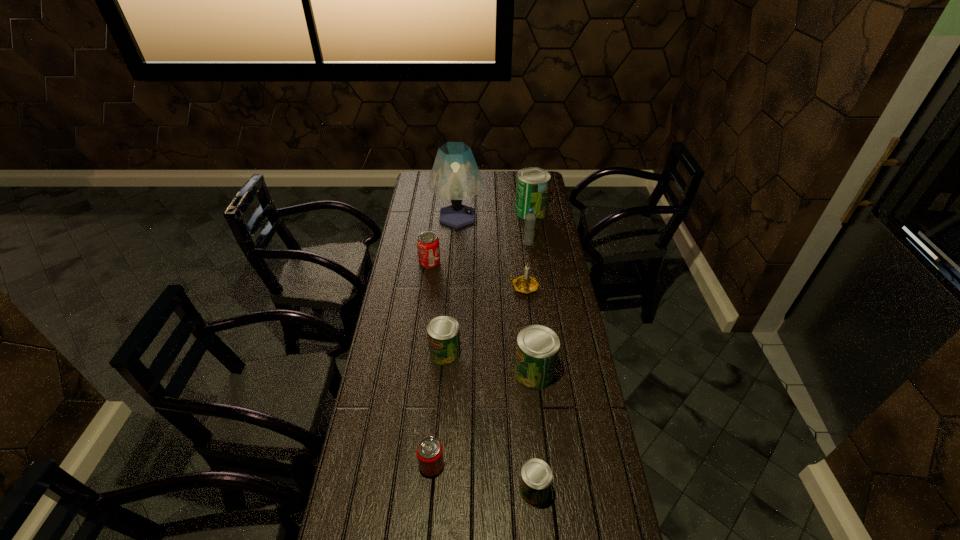
Where is `free spot located on the right of the candle holder`? Image resolution: width=960 pixels, height=540 pixels. free spot located on the right of the candle holder is located at coordinates (550, 287).

Find the location of a particular element. This screenshot has width=960, height=540. vacant position located on the right of the nearer red can is located at coordinates (491, 465).

Where is `free space located on the left of the nearest green can`? This screenshot has height=540, width=960. free space located on the left of the nearest green can is located at coordinates (381, 490).

Where is `lampshade located at the left edge`? The image size is (960, 540). lampshade located at the left edge is located at coordinates (455, 176).

Where is `can situated at the left edge`? The height and width of the screenshot is (540, 960). can situated at the left edge is located at coordinates tap(428, 249).

Image resolution: width=960 pixels, height=540 pixels. Identify the location of water bottle that is at the right edge. (530, 219).

This screenshot has height=540, width=960. I want to click on candle holder located in the right edge section of the desktop, so click(x=525, y=284).

The image size is (960, 540). In the image, there is a desktop. Find the location of `vacant space at the far edge`. vacant space at the far edge is located at coordinates pyautogui.click(x=487, y=180).

The height and width of the screenshot is (540, 960). What are the coordinates of `vacant space at the left edge` in the screenshot? It's located at (416, 300).

I want to click on vacant region at the right edge of the desktop, so click(545, 289).